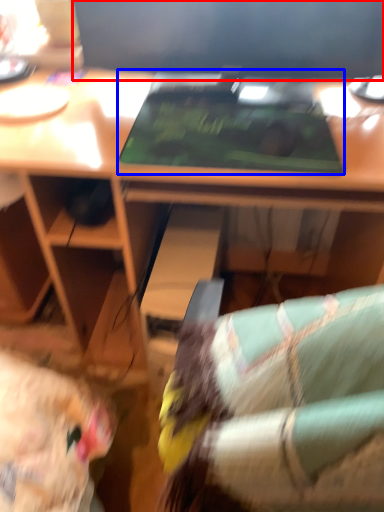
Question: Which object is closer to the camera taking this photo, computer monitor (highlighted by a red box) or laptop (highlighted by a blue box)?

Choices:
 (A) computer monitor
 (B) laptop

Answer: (B)